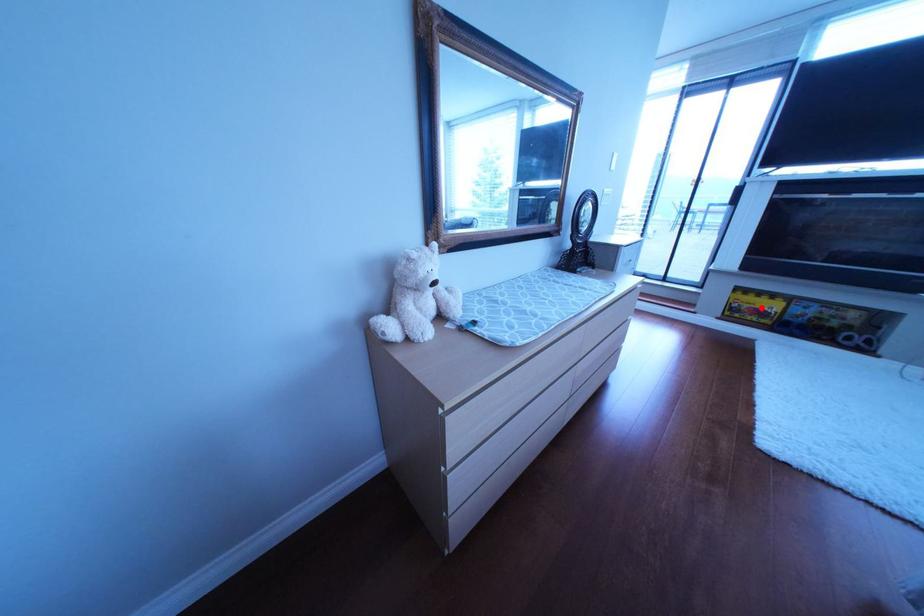
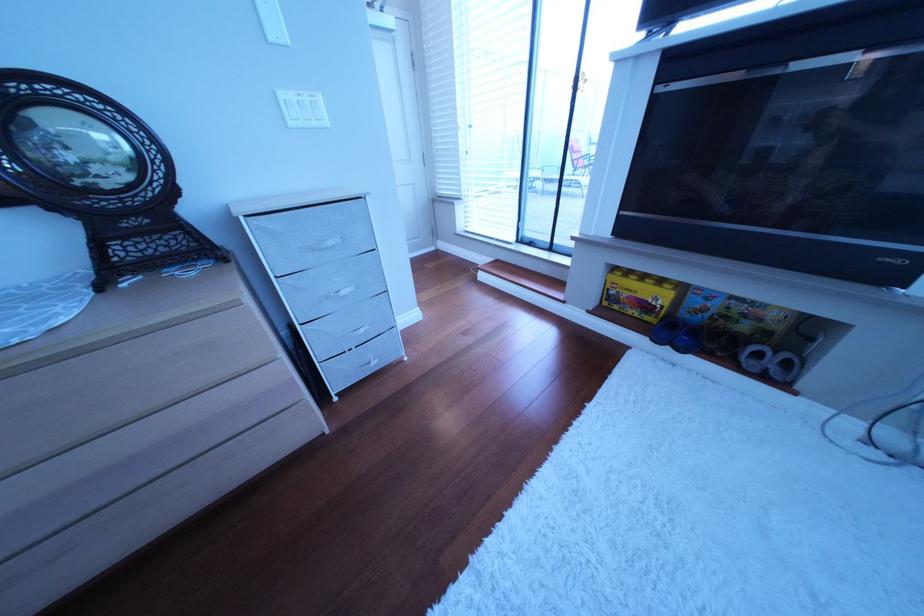
Question: I am providing you with two images of the same scene from different viewpoints. Image1 has a red point marked. In image2, the corresponding 3D location appears at what relative position? Reply with the corresponding letter.

Choices:
 (A) Closer
 (B) Farther

Answer: (A)